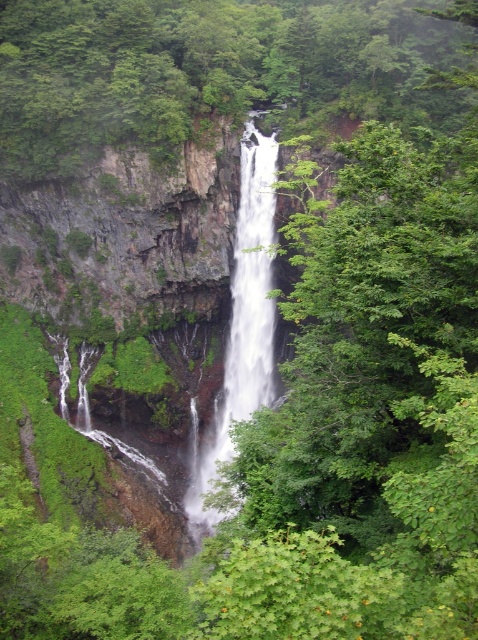
Does green leafy tree at center have a lesser height compared to white smooth waterfall at center?

No, green leafy tree at center is not shorter than white smooth waterfall at center.

Who is more forward, [290,125] or [195,508]?

Point [195,508] is in front.

Identify the location of green leafy tree at center. This screenshot has height=640, width=478. (206, 72).